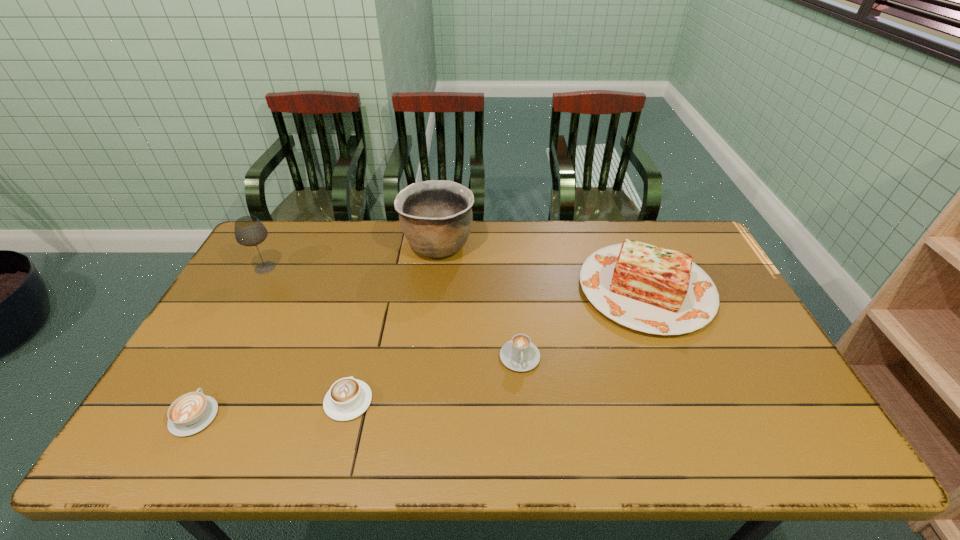
You are a GUI agent. You are given a task and a screenshot of the screen. Output one action in this format:
    pyautogui.click(x=<x>, y=<y>)
    Task: Click on the free space at the far edge of the desktop
    
    Given the screenshot: What is the action you would take?
    pyautogui.click(x=347, y=241)

In the image, there is a desktop. Where is `free space at the near edge`? Image resolution: width=960 pixels, height=540 pixels. free space at the near edge is located at coordinates (708, 448).

Find the location of `blank space at the left edge`. blank space at the left edge is located at coordinates (253, 276).

What are the coordinates of `free space at the right edge of the desktop` in the screenshot? It's located at (751, 353).

Where is `free space at the far left corner`? Image resolution: width=960 pixels, height=540 pixels. free space at the far left corner is located at coordinates (293, 241).

This screenshot has width=960, height=540. Find the location of `free spot between the shortest object and the second cappuccino from left to right`. free spot between the shortest object and the second cappuccino from left to right is located at coordinates (272, 408).

I want to click on empty space that is in between the second shortest cappuccino and the third shortest object, so click(434, 379).

You are a GUI agent. You are given a task and a screenshot of the screen. Output one action in this format:
    pyautogui.click(x=<x>, y=<y>)
    Task: Click on the empty space that is in between the third nearest object and the rightmost object
    The width and height of the screenshot is (960, 540).
    Given the screenshot: What is the action you would take?
    pyautogui.click(x=583, y=323)

At what (x,y) coordinates should I click in order to perform the action: click on free area in between the rightmost object and the pottery. Please return your answer as a coordinate pair (x, y). This screenshot has width=960, height=540. Looking at the image, I should click on (542, 267).

What are the coordinates of `vacant region between the pottery and the second cappuccino from left to right` in the screenshot? It's located at (394, 323).